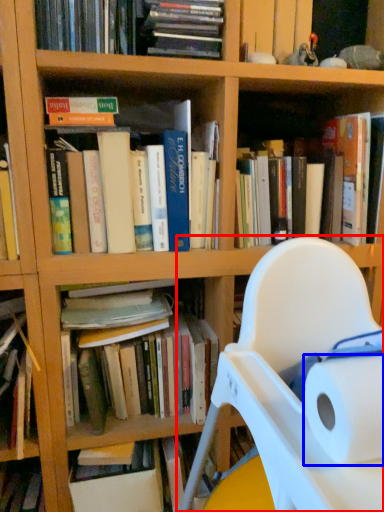
Question: Which of the following is the farthest to the observer, chair (highlighted by a red box) or paper towel (highlighted by a blue box)?

Choices:
 (A) chair
 (B) paper towel

Answer: (B)